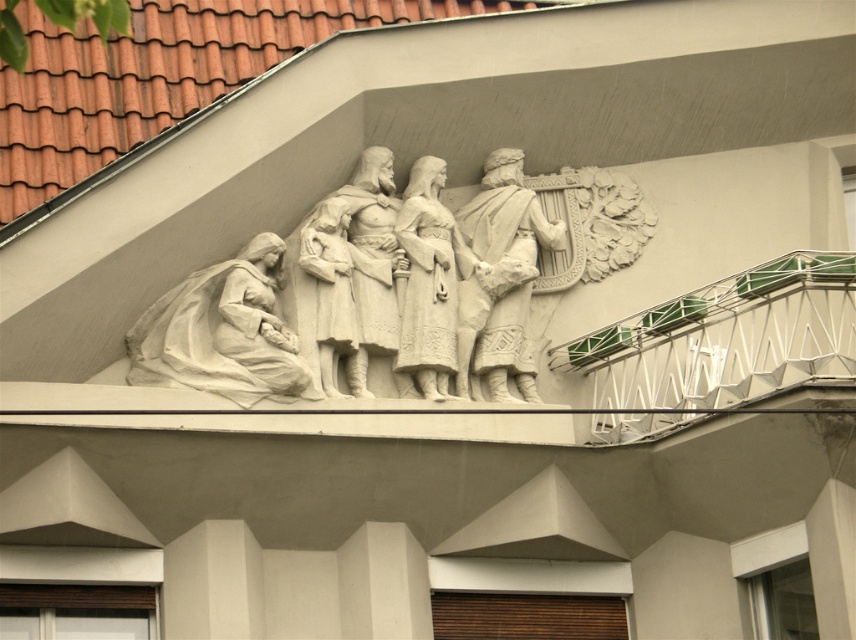
Is white stone carving at center thinner than white stone harp at center?

Incorrect, white stone carving at center's width is not less than white stone harp at center's.

Is point (348, 305) positioned after point (485, 241)?

No, (348, 305) is in front of (485, 241).

Find the location of `white stone carving at center`. white stone carving at center is located at coordinates (354, 272).

Locate an element on the screen. This screenshot has width=856, height=640. white stone carving at center is located at coordinates (354, 272).

Can you confirm if white stone figure at left is positioned below white stone harp at center?

Yes.

Consider the image. Who is higher up, white stone figure at left or white stone harp at center?

white stone harp at center is above.

Does point (272, 348) lie behind point (497, 211)?

No, it is not.

This screenshot has width=856, height=640. What are the coordinates of `white stone figure at left` in the screenshot? It's located at tap(223, 332).

Is point (280, 362) positioned in front of point (346, 208)?

Yes, it is in front of point (346, 208).

Does white stone figure at left have a larger size compared to white stone carving at center?

Yes.

Locate an element on the screen. The width and height of the screenshot is (856, 640). white stone figure at left is located at coordinates (223, 332).